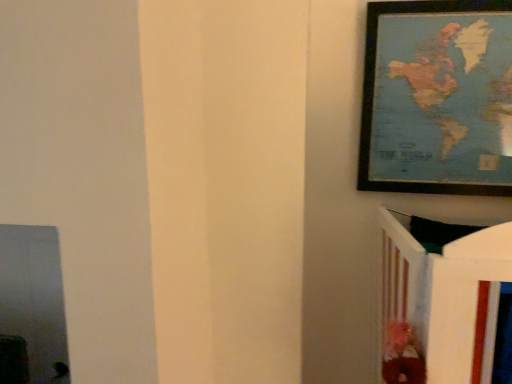
The height and width of the screenshot is (384, 512). What do you see at coordinates (437, 98) in the screenshot?
I see `black framed map at upper right` at bounding box center [437, 98].

Identify the location of black framed map at upper right. Image resolution: width=512 pixels, height=384 pixels. (437, 98).

Image resolution: width=512 pixels, height=384 pixels. I want to click on black framed map at upper right, so click(x=437, y=98).